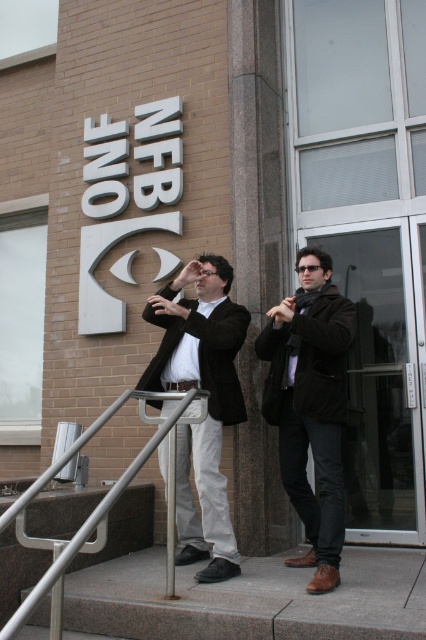
Question: Which is nearer to the velvet brown coat at center?

Choices:
 (A) matte black jacket at center
 (B) silver metallic handrail at lower center

Answer: (A)

Question: Which of the following is the closest to the observer?

Choices:
 (A) velvet brown coat at center
 (B) matte black jacket at center

Answer: (A)

Question: Which point is closer to the camera?

Choices:
 (A) matte black jacket at center
 (B) velvet brown coat at center
 (C) silver metallic handrail at lower center

Answer: (C)

Question: Can you confirm if velvet brown coat at center is wider than silver metallic handrail at lower center?

Choices:
 (A) yes
 (B) no

Answer: (B)

Question: In this image, where is matte black jacket at center located relative to silver metallic handrail at lower center?

Choices:
 (A) left
 (B) right

Answer: (B)

Question: Does matte black jacket at center appear over silver metallic handrail at lower center?

Choices:
 (A) no
 (B) yes

Answer: (B)